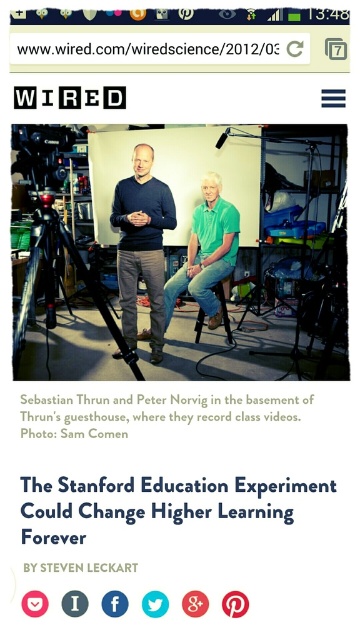
Question: Which of the following is the closest to the observer?

Choices:
 (A) (129, 291)
 (B) (33, 168)
 (C) (33, 492)

Answer: (C)

Question: Which point is closer to the camera?

Choices:
 (A) (124, 262)
 (B) (196, 323)
 (C) (169, 490)

Answer: (C)

Question: Can you confirm if matte black sweater at center is thinner than black plastic video camera at upper left?

Choices:
 (A) yes
 (B) no

Answer: (B)

Question: Is matte black sweater at center to the right of matte black tripod at center from the viewer's perspective?

Choices:
 (A) no
 (B) yes

Answer: (B)

Question: From the image, what is the correct spatial relationship of matte black sweater at center in relation to matte plastic stool at center?

Choices:
 (A) below
 (B) above

Answer: (B)

Question: Which is farther from the matte black sweater at center?

Choices:
 (A) white paper at center
 (B) green cotton shirt at center

Answer: (A)